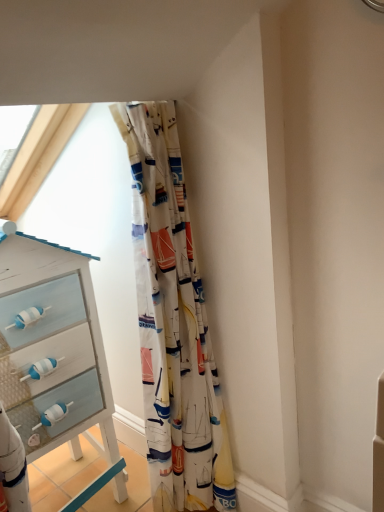
What do you see at coordinates (173, 323) in the screenshot? I see `printed fabric curtain at center` at bounding box center [173, 323].

Locate an element on the screen. printed fabric curtain at center is located at coordinates (x=173, y=323).

Identify the location of white painted wood chest of drawers at left. (54, 353).

Describe the element at coordinates (54, 353) in the screenshot. I see `white painted wood chest of drawers at left` at that location.

Measure the distance between white painted wood chest of drawers at left and camera.

The depth of white painted wood chest of drawers at left is 1.06 meters.

At what (x,y) coordinates should I click in order to perform the action: click on printed fabric curtain at center. Please return your answer as a coordinate pair (x, y). The image size is (384, 512). Looking at the image, I should click on (173, 323).

Which object is positioned more to the right, printed fabric curtain at center or white painted wood chest of drawers at left?

printed fabric curtain at center is more to the right.

Is printed fabric curtain at center in front of white painted wood chest of drawers at left?

Yes, printed fabric curtain at center is closer to the camera.

Considering the positions of point (142, 294) and point (91, 492), is point (142, 294) closer or farther from the camera than point (91, 492)?

Point (142, 294) appears to be closer to the viewer than point (91, 492).

From the image's perspective, is printed fabric curtain at center on top of white painted wood chest of drawers at left?

Yes, from the image's perspective, printed fabric curtain at center is over white painted wood chest of drawers at left.

From a real-world perspective, is printed fabric curtain at center below white painted wood chest of drawers at left?

Actually, printed fabric curtain at center is physically above white painted wood chest of drawers at left in the real world.

Can you confirm if printed fabric curtain at center is thinner than white painted wood chest of drawers at left?

Yes, printed fabric curtain at center is thinner than white painted wood chest of drawers at left.

Considering the sizes of objects printed fabric curtain at center and white painted wood chest of drawers at left in the image provided, who is shorter, printed fabric curtain at center or white painted wood chest of drawers at left?

white painted wood chest of drawers at left is shorter.

From the picture: Between printed fabric curtain at center and white painted wood chest of drawers at left, which one has larger size?

Bigger between the two is white painted wood chest of drawers at left.

Can we say printed fabric curtain at center lies outside white painted wood chest of drawers at left?

Yes, printed fabric curtain at center is outside of white painted wood chest of drawers at left.

Is printed fabric curtain at center placed right next to white painted wood chest of drawers at left?

No.

Is printed fabric curtain at center positioned with its back to white painted wood chest of drawers at left?

No, printed fabric curtain at center's orientation is not away from white painted wood chest of drawers at left.

The width and height of the screenshot is (384, 512). Find the location of `curtain that appears above the white painted wood chest of drawers at left (from the image's perspective)`. curtain that appears above the white painted wood chest of drawers at left (from the image's perspective) is located at coordinates (173, 323).

Does white painted wood chest of drawers at left appear on the right side of printed fabric curtain at center?

No.

Which is behind, white painted wood chest of drawers at left or printed fabric curtain at center?

white painted wood chest of drawers at left is more distant.

Does point (19, 415) come farther from viewer compared to point (203, 317)?

That is False.

From the image's perspective, between white painted wood chest of drawers at left and printed fabric curtain at center, who is located below?

From the image's view, white painted wood chest of drawers at left is below.

From a real-world perspective, is white painted wood chest of drawers at left physically below printed fabric curtain at center?

Indeed, from a real-world perspective, white painted wood chest of drawers at left is positioned beneath printed fabric curtain at center.

Which object is thinner, white painted wood chest of drawers at left or printed fabric curtain at center?

printed fabric curtain at center is thinner.

Is white painted wood chest of drawers at left shorter than printed fabric curtain at center?

Yes, white painted wood chest of drawers at left is shorter than printed fabric curtain at center.

Considering the relative sizes of white painted wood chest of drawers at left and printed fabric curtain at center in the image provided, is white painted wood chest of drawers at left bigger than printed fabric curtain at center?

Yes.

Is white painted wood chest of drawers at left completely or partially outside of printed fabric curtain at center?

Yes, white painted wood chest of drawers at left is located beyond the bounds of printed fabric curtain at center.

Would you consider white painted wood chest of drawers at left to be distant from printed fabric curtain at center?

Actually, white painted wood chest of drawers at left and printed fabric curtain at center are a little close together.

Is white painted wood chest of drawers at left looking in the opposite direction of printed fabric curtain at center?

No.

Measure the distance between white painted wood chest of drawers at left and printed fabric curtain at center.

They are 11.25 inches apart.

The image size is (384, 512). Find the location of `curtain located above the white painted wood chest of drawers at left (from the image's perspective)`. curtain located above the white painted wood chest of drawers at left (from the image's perspective) is located at coordinates (173, 323).

Locate an element on the screen. The height and width of the screenshot is (512, 384). curtain above the white painted wood chest of drawers at left (from the image's perspective) is located at coordinates (173, 323).

This screenshot has height=512, width=384. Find the location of `curtain in front of the white painted wood chest of drawers at left`. curtain in front of the white painted wood chest of drawers at left is located at coordinates (173, 323).